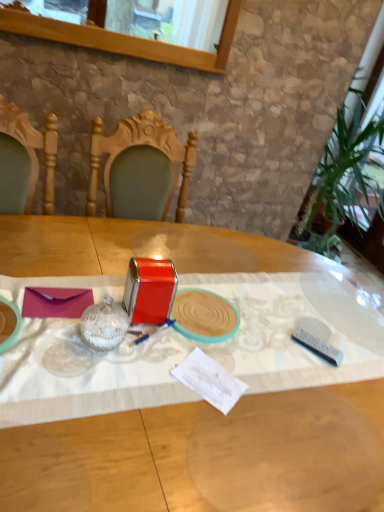
Where is `vacant space to the right of white plastic remote at lower right, the first tableware when ordered from right to left`? vacant space to the right of white plastic remote at lower right, the first tableware when ordered from right to left is located at coordinates (362, 355).